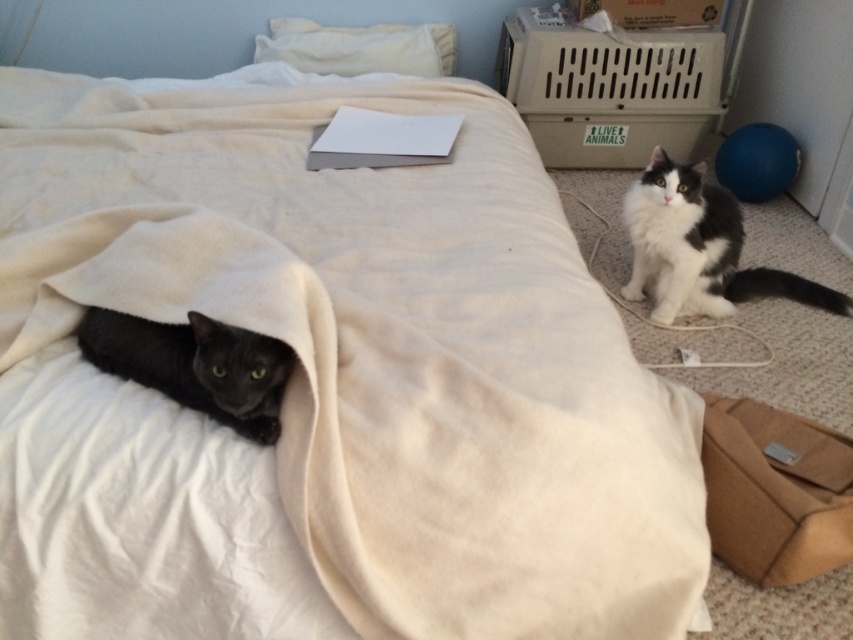
You are a cat owner who wants to place a new toy between the shiny black cat at lower left and the white soft pillow at upper center. Based on their sizes, which object should the toy be closer to?

The shiny black cat at lower left is smaller than the white soft pillow at upper center, so the toy should be placed closer to the white soft pillow at upper center to ensure it is accessible to both.

You are a cat owner trying to locate your two cats in the bedroom. You see two points marked in the image. One is at point (735, 502) and the other at point (260, 397). Based on their positions, which point is closer to the bed covered with a light beige blanket?

Point (260, 397) is closer to the bed covered with a light beige blanket because point (735, 502) is behind point (260, 397), meaning it is farther away from the bed.

Consider the image. You are standing in the bedroom and want to place a small toy exactly at the point marked as point (659, 195). Considering the cats are on opposite sides of the room, which cat is closer to the point where you want to place the toy?

The point (659, 195) is 6.08 feet away from the viewer. Since the dark gray cat is on the left side under the bed and the black and white cat is on the right side on the floor, the distance from each cat to the point would depend on their positions relative to the viewer. However, without specific distances for both cats, we cannot determine which is closer.